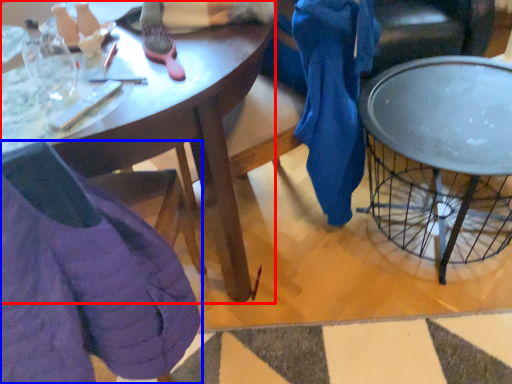
Question: Among these objects, which one is farthest to the camera, desk (highlighted by a red box) or chair (highlighted by a blue box)?

Choices:
 (A) desk
 (B) chair

Answer: (A)